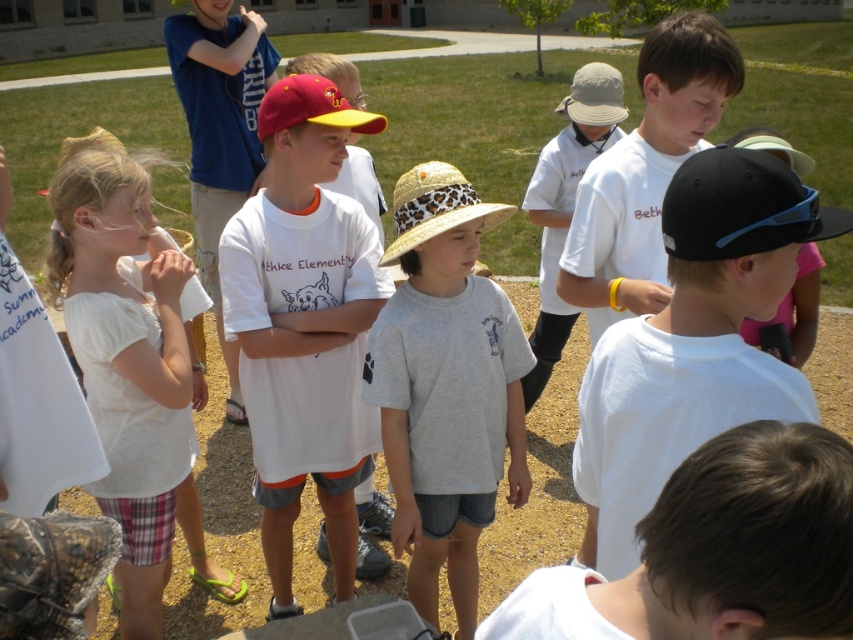
Question: Is gray cotton shirt at center thinner than black matte cap at center?

Choices:
 (A) no
 (B) yes

Answer: (A)

Question: Does matte white t-shirt at center appear on the right side of white cotton shirt at left?

Choices:
 (A) yes
 (B) no

Answer: (A)

Question: Which object appears closest to the camera in this image?

Choices:
 (A) white matte shirt at center
 (B) white cotton shirt at center
 (C) black matte cap at center
 (D) brown hair at lower right

Answer: (D)

Question: Is black matte cap at center wider than white cotton shirt at left?

Choices:
 (A) no
 (B) yes

Answer: (A)

Question: Which point appears closest to the camera in this image?

Choices:
 (A) (257, 497)
 (B) (596, 548)
 (C) (421, 356)
 (D) (549, 305)

Answer: (B)

Question: Estimate the real-world distances between objects in this image. Which object is farther from the white cotton shirt at center?

Choices:
 (A) matte white t-shirt at center
 (B) gray cotton shirt at center
 (C) white matte shirt at center

Answer: (B)